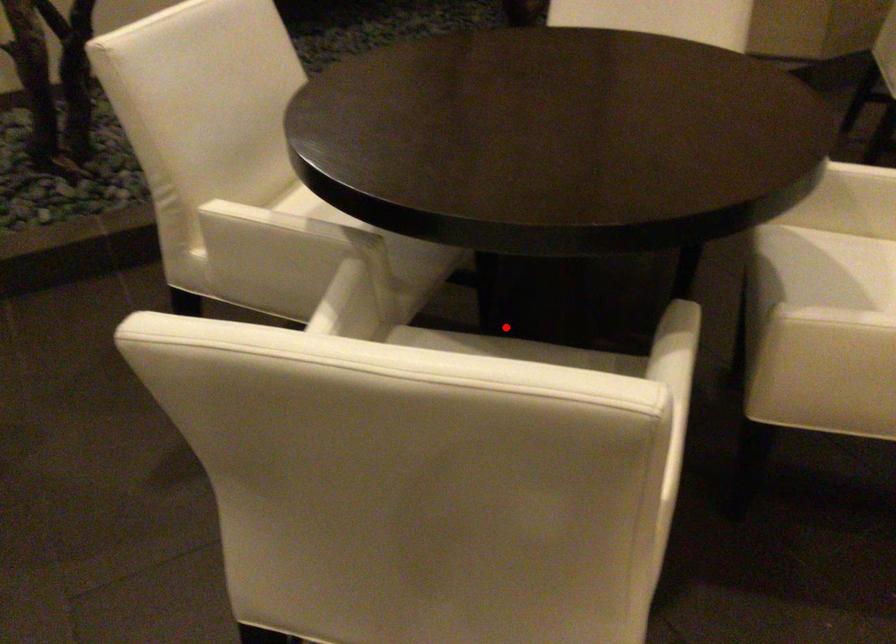
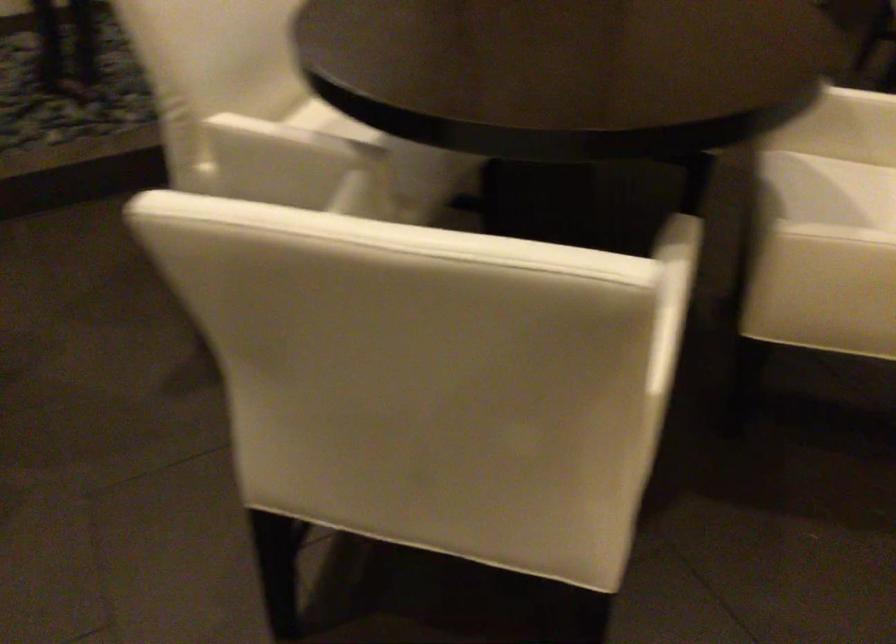
Question: I am providing you with two images of the same scene from different viewpoints. A red point is marked on the first image. Is the red point's position out of view in image 2?

Choices:
 (A) Yes
 (B) No

Answer: (A)